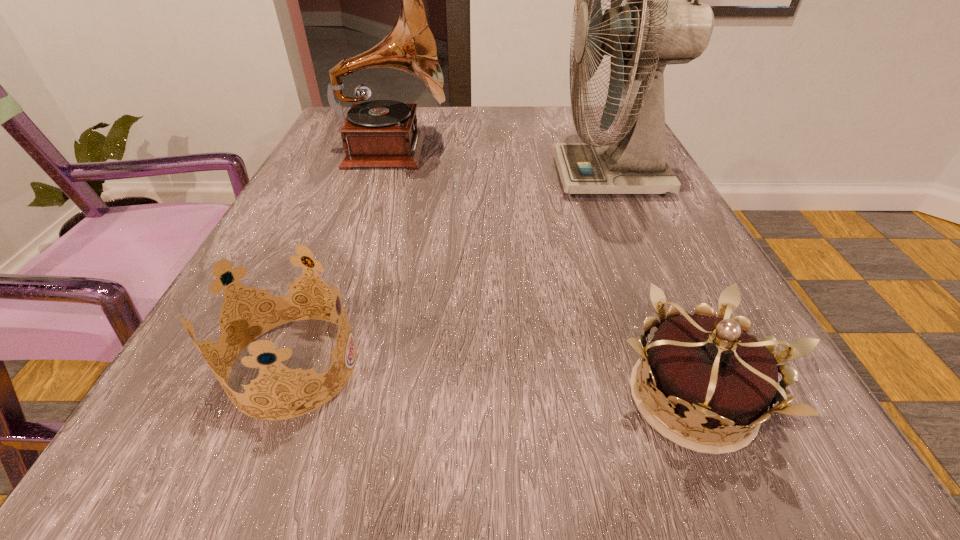
Find the location of `fan situated at the far edge`. fan situated at the far edge is located at coordinates (647, 35).

You are a GUI agent. You are given a task and a screenshot of the screen. Output one action in this format:
    pyautogui.click(x=<x>, y=<y>)
    Task: Click on the phonograph_record situated at the far edge
    The image size is (960, 540).
    Given the screenshot: What is the action you would take?
    pyautogui.click(x=380, y=133)

The height and width of the screenshot is (540, 960). What are the coordinates of `object present at the near edge` in the screenshot? It's located at (708, 369).

You are a GUI agent. You are given a task and a screenshot of the screen. Output one action in this format:
    pyautogui.click(x=<x>, y=<y>)
    Task: Click on the phonograph_record at the left edge
    The height and width of the screenshot is (540, 960).
    Given the screenshot: What is the action you would take?
    pyautogui.click(x=380, y=133)

Image resolution: width=960 pixels, height=540 pixels. Find the location of `crown that is positioned at the left edge`. crown that is positioned at the left edge is located at coordinates (231, 303).

Identify the location of fan positioned at the right edge. (647, 35).

Find the location of a particular element. crown at the right edge is located at coordinates (708, 369).

Where is `object that is at the far left corner`? This screenshot has height=540, width=960. object that is at the far left corner is located at coordinates (380, 133).

Where is `object that is at the far right corner`? Image resolution: width=960 pixels, height=540 pixels. object that is at the far right corner is located at coordinates (647, 35).

Identify the location of object present at the near right corner. Image resolution: width=960 pixels, height=540 pixels. (708, 369).